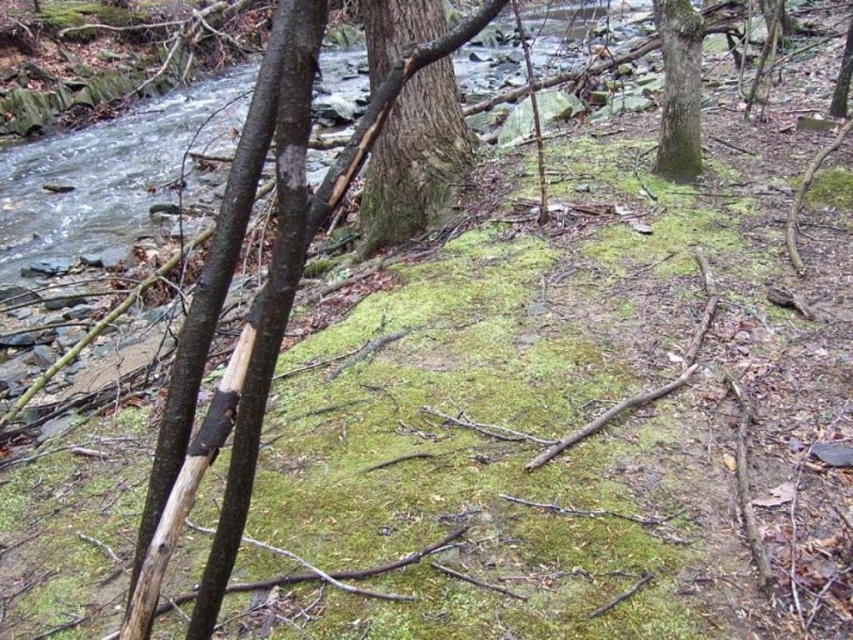
You are a hiker who wants to cross the stream using the green rough bark tree trunk at center and the green rough bark tree trunk at upper right as stepping stones. Which trunk should you step on first?

The green rough bark tree trunk at center is located below the green rough bark tree trunk at upper right. Since the trunk at center is lower, you should step on the green rough bark tree trunk at center first to reach the one at upper right.

You are a hiker trying to cross the stream in the forest. You see two fallen tree trunks that could serve as bridges. The first is the green rough bark tree trunk at center, and the second is the green rough bark tree trunk at upper right. Which tree trunk is positioned closer to the left side of the stream?

The green rough bark tree trunk at center is to the left of the green rough bark tree trunk at upper right, so it is closer to the left side of the stream.

You are a hiker who wants to cross the stream using the green rough bark tree trunk at center and the green rough bark tree trunk at upper right as stepping stones. Which tree trunk should you step on first?

The green rough bark tree trunk at center is closer to the viewer than the green rough bark tree trunk at upper right, so you should step on the green rough bark tree trunk at center first.